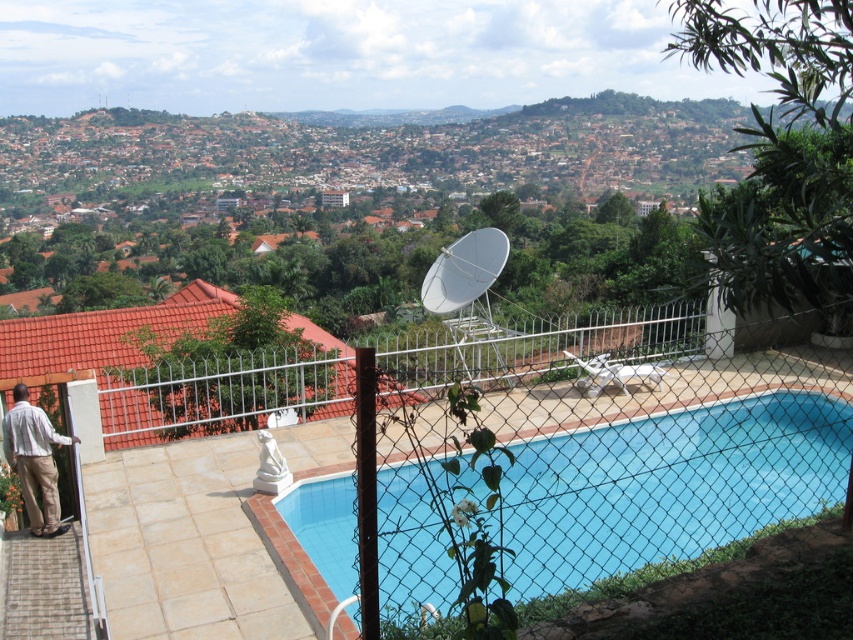
You are standing at the edge of the blue smooth pool at center and want to hand a towel to the person wearing light brown cotton pants at lower left. Which direction should you walk to reach them?

The light brown cotton pants at lower left are farther from the viewer than the blue smooth pool at center. You should walk towards the lower left direction away from the pool to reach them.

Consider the image. You are standing at the point with coordinates [666,486] in the image. Based on the scene description, what object are you most likely standing on?

The point [666,486] corresponds to the blue smooth pool at center, so you are most likely standing on the blue smooth pool at center.